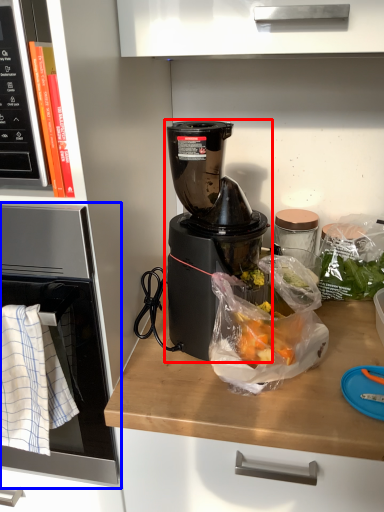
Question: Which object is closer to the camera taking this photo, blender (highlighted by a red box) or oven (highlighted by a blue box)?

Choices:
 (A) blender
 (B) oven

Answer: (B)